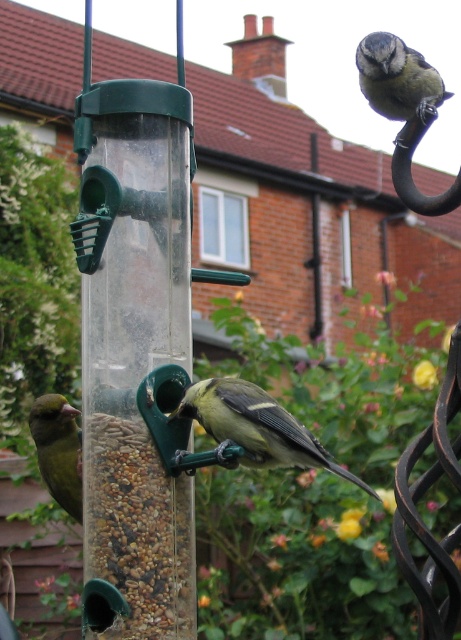
Between point (260, 458) and point (374, 99), which one is positioned in front?

Positioned in front is point (260, 458).

Can you confirm if yellow matte bird at center is wider than blue speckled bird at upper right?

Yes.

Is point (204, 388) positioned after point (383, 45)?

Yes, it is behind point (383, 45).

I want to click on yellow matte bird at center, so click(255, 428).

Is point (405, 74) farther from viewer compared to point (59, 481)?

No, (405, 74) is closer to viewer.

Looking at this image, is blue speckled bird at upper right shorter than green matte bird at left?

Yes, blue speckled bird at upper right is shorter than green matte bird at left.

Is point (368, 70) positioned behind point (58, 413)?

No.

Find the location of a particular element. blue speckled bird at upper right is located at coordinates (397, 77).

Is yellow matte bird at center wider than green matte bird at left?

Yes, yellow matte bird at center is wider than green matte bird at left.

Is point (213, 426) positioned behind point (59, 394)?

No, it is in front of (59, 394).

Where is `yellow matte bird at center`? yellow matte bird at center is located at coordinates coord(255,428).